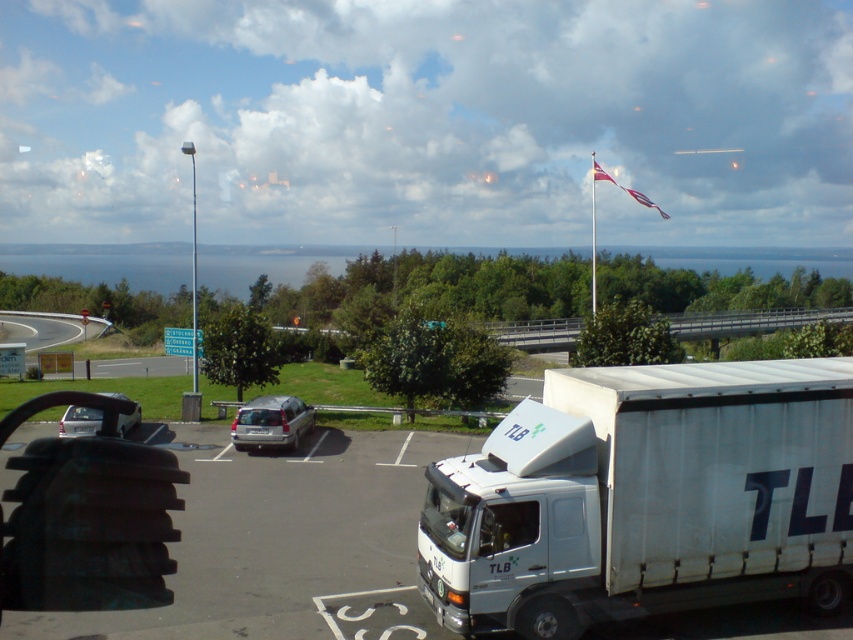
You are a delivery driver who needs to park your vehicle in the parking lot. You see the white matte trailer truck at lower right and the gray asphalt road at lower left. Which one is a better option for parking your delivery van?

The white matte trailer truck at lower right has a smaller size compared to the gray asphalt road at lower left, so the gray asphalt road at lower left is a better option for parking your delivery van because it is larger and more suitable for vehicle parking.

You are a delivery person who needs to load packages into the back of your truck. You have two vehicles in view, a silver metallic van at center and a silver metallic hatchback at lower left. Which vehicle has a lower height that might be easier to load packages into?

The silver metallic van at center has a lesser height compared to the silver metallic hatchback at lower left, so it might be easier to load packages into the silver metallic van at center.

You are a delivery driver who needs to turn around your large truck to exit the parking area. You see the gray asphalt road at lower left and the silver metallic hatchback at lower left. Which one has enough space for your truck to maneuver?

The gray asphalt road at lower left is bigger than the silver metallic hatchback at lower left, so the gray asphalt road at lower left has enough space for the truck to maneuver.